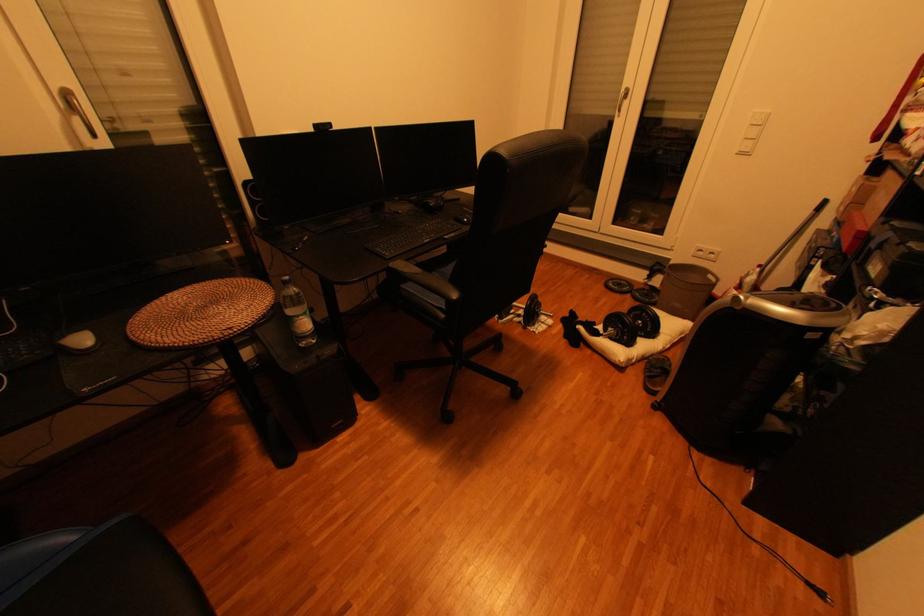
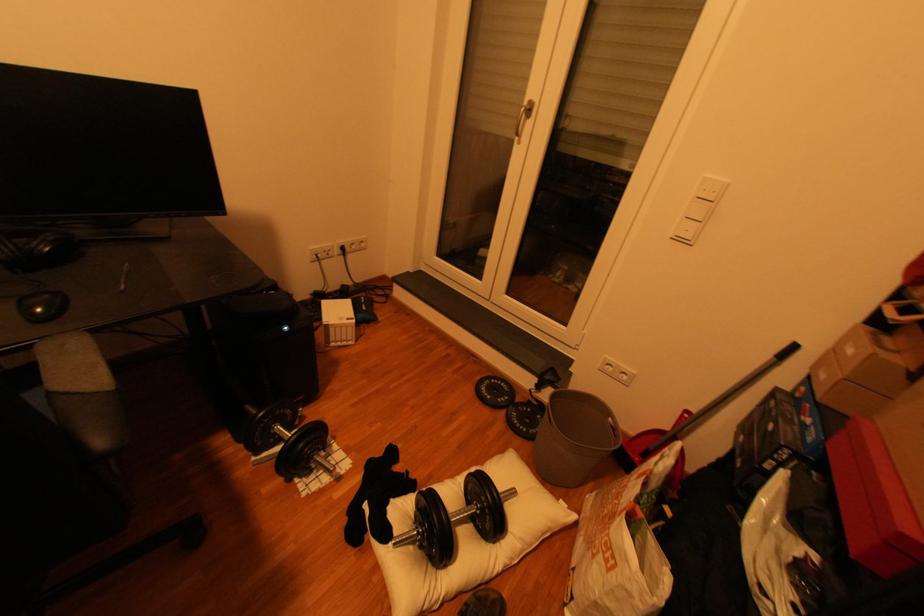
Find the pixel in the second image that matches point 749,155 in the first image.

(687, 240)